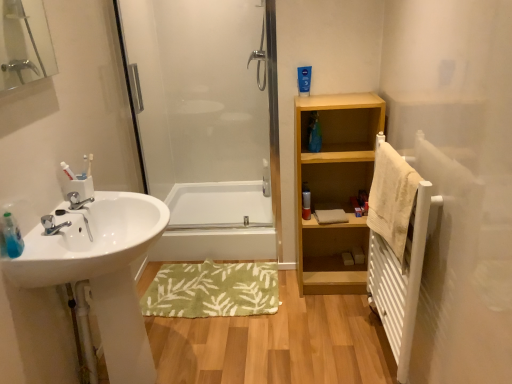
This screenshot has height=384, width=512. Find the location of `unoccupied area in front of light wood shelf at center right`. unoccupied area in front of light wood shelf at center right is located at coordinates (332, 314).